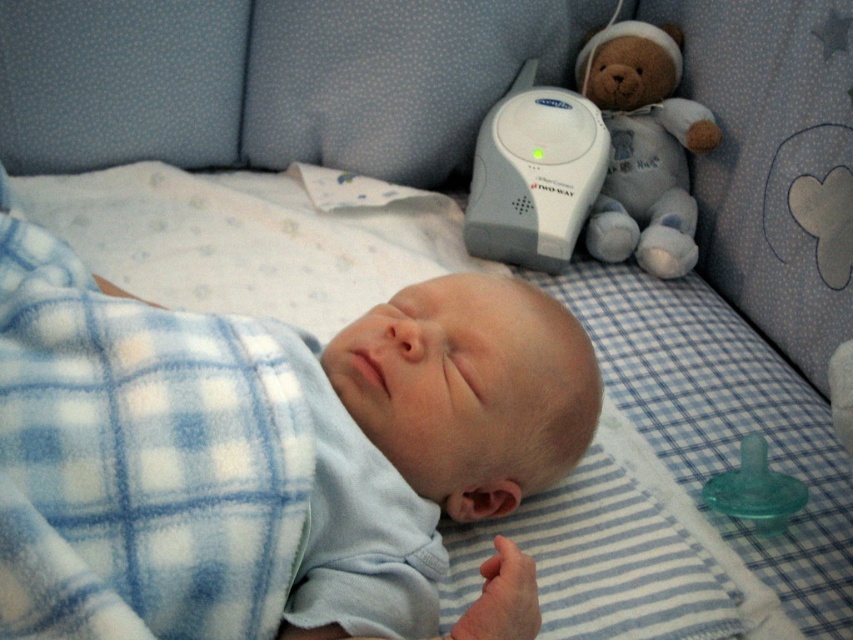
You are a parent checking on your baby. You see the soft plush teddy bear at upper right and the white plastic baby monitor at upper center. Which object is narrower?

The soft plush teddy bear at upper right is narrower than the white plastic baby monitor at upper center.

In the scene shown: You are a nurse checking the baby in the crib. You notice two points marked on the crib fabric. Which point is closer to you, point (650, 56) or point (511, 241)?

Point (650, 56) is closer to you than point (511, 241).

You are a parent looking at your baby in the crib. You notice a point marked at coordinates (262, 451). Based on the scene, what does this point most likely represent?

The point at coordinates (262, 451) marks the location of the blue fleece baby at center.